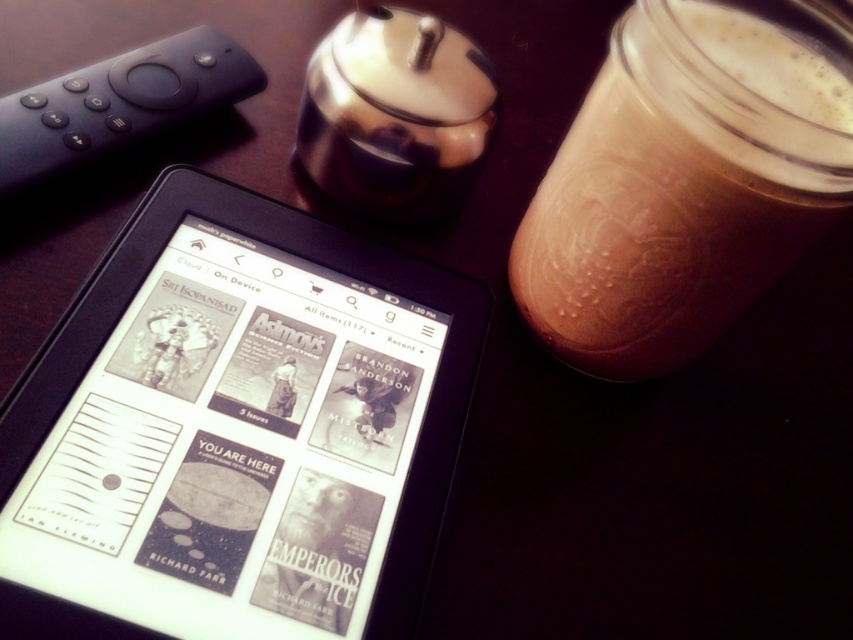
You are holding a black remote control on the left and want to reach the point at coordinates (235, 429) on the black e reader at center. Can you reach it without moving the remote control?

The point at coordinates (235, 429) is on the black e reader at center, so yes, you can reach it by extending your arm from the black remote control on the left as long as there is no obstruction between them.